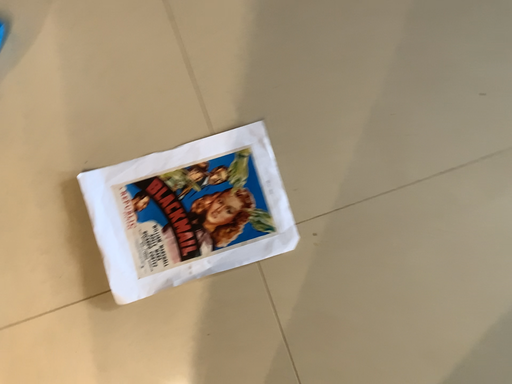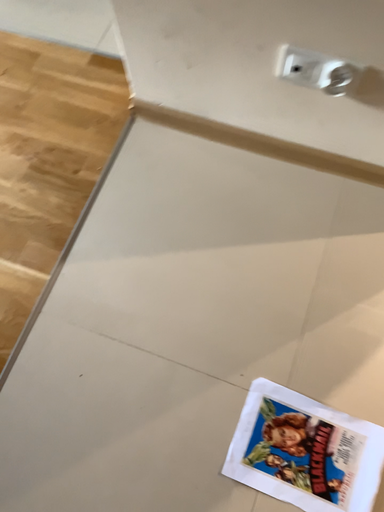
Question: How did the camera likely rotate when shooting the video?

Choices:
 (A) rotated downward
 (B) rotated upward

Answer: (B)